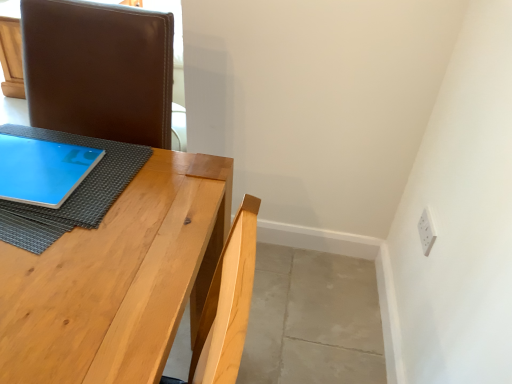
Locate an element on the screen. This screenshot has height=384, width=512. blue fabric at upper left is located at coordinates (73, 192).

Identify the location of blue fabric at upper left. (73, 192).

From the image's perspective, is blue fabric at upper left on natural wood table at center?

Indeed, from the image's perspective, blue fabric at upper left is shown above natural wood table at center.

Considering the relative sizes of blue fabric at upper left and natural wood table at center in the image provided, is blue fabric at upper left taller than natural wood table at center?

Incorrect, the height of blue fabric at upper left is not larger of that of natural wood table at center.

Is blue fabric at upper left far from natural wood table at center?

No, blue fabric at upper left is not far away from natural wood table at center.

The height and width of the screenshot is (384, 512). I want to click on table that is below the blue fabric at upper left (from the image's perspective), so click(116, 277).

From the image's perspective, is blue fabric at upper left positioned above or below white plastic electric outlet at upper right?

From the image's perspective, blue fabric at upper left appears above white plastic electric outlet at upper right.

Can you confirm if blue fabric at upper left is thinner than white plastic electric outlet at upper right?

No.

Is blue fabric at upper left outside of white plastic electric outlet at upper right?

Yes, blue fabric at upper left is located beyond the bounds of white plastic electric outlet at upper right.

Between blue fabric at upper left and white plastic electric outlet at upper right, which one has smaller size?

With smaller size is white plastic electric outlet at upper right.

Is matte blue tablet at left further to camera compared to white plastic electric outlet at upper right?

No, matte blue tablet at left is closer to the viewer.

Image resolution: width=512 pixels, height=384 pixels. Identify the location of electric outlet below the matte blue tablet at left (from a real-world perspective). (426, 231).

Could you tell me if matte blue tablet at left is facing white plastic electric outlet at upper right?

No.

Which object is positioned more to the right, matte blue tablet at left or white plastic electric outlet at upper right?

white plastic electric outlet at upper right.

Considering the relative sizes of matte blue tablet at left and natural wood table at center in the image provided, is matte blue tablet at left shorter than natural wood table at center?

Yes, matte blue tablet at left is shorter than natural wood table at center.

Does matte blue tablet at left have a lesser width compared to natural wood table at center?

Indeed, matte blue tablet at left has a lesser width compared to natural wood table at center.

How different are the orientations of natural wood table at center and blue fabric at upper left in degrees?

The angle between the facing direction of natural wood table at center and the facing direction of blue fabric at upper left is 3.26 degrees.

Can you confirm if natural wood table at center is thinner than blue fabric at upper left?

Yes.

Where is `table directly beneath the blue fabric at upper left (from a real-world perspective)`? Image resolution: width=512 pixels, height=384 pixels. table directly beneath the blue fabric at upper left (from a real-world perspective) is located at coordinates 116,277.

Does natural wood table at center lie behind blue fabric at upper left?

No, natural wood table at center is closer to the camera.

Is natural wood table at center next to white plastic electric outlet at upper right and touching it?

There is a gap between natural wood table at center and white plastic electric outlet at upper right.

Considering the relative sizes of natural wood table at center and white plastic electric outlet at upper right in the image provided, is natural wood table at center taller than white plastic electric outlet at upper right?

Yes, natural wood table at center is taller than white plastic electric outlet at upper right.

From a real-world perspective, is natural wood table at center above or below white plastic electric outlet at upper right?

From a real-world perspective, natural wood table at center is physically above white plastic electric outlet at upper right.

From the image's perspective, is natural wood table at center over white plastic electric outlet at upper right?

No, from the image's perspective, natural wood table at center is not over white plastic electric outlet at upper right.

Is matte blue tablet at left oriented away from blue fabric at upper left?

No, matte blue tablet at left's orientation is not away from blue fabric at upper left.

Can you confirm if matte blue tablet at left is taller than blue fabric at upper left?

Yes.

Which is more to the left, matte blue tablet at left or blue fabric at upper left?

Positioned to the left is matte blue tablet at left.

Identify the location of table below the blue fabric at upper left (from a real-world perspective). (116, 277).

Where is `electric outlet that is below the blue fabric at upper left (from the image's perspective)`? electric outlet that is below the blue fabric at upper left (from the image's perspective) is located at coordinates (426, 231).

From the image, which object appears to be nearer to matte blue tablet at left, white plastic electric outlet at upper right or blue fabric at upper left?

The object closer to matte blue tablet at left is blue fabric at upper left.

Which object lies further to the anchor point white plastic electric outlet at upper right, natural wood table at center or matte blue tablet at left?

The object further to white plastic electric outlet at upper right is matte blue tablet at left.

Considering their positions, is blue fabric at upper left positioned further to natural wood table at center than matte blue tablet at left?

Based on the image, matte blue tablet at left appears to be further to natural wood table at center.

From the image, which object appears to be nearer to blue fabric at upper left, natural wood table at center or matte blue tablet at left?

Based on the image, matte blue tablet at left appears to be nearer to blue fabric at upper left.

Which object lies further to the anchor point blue fabric at upper left, matte blue tablet at left or white plastic electric outlet at upper right?

white plastic electric outlet at upper right is further to blue fabric at upper left.

From the image, which object appears to be farther from white plastic electric outlet at upper right, natural wood table at center or blue fabric at upper left?

blue fabric at upper left lies further to white plastic electric outlet at upper right than the other object.

Looking at the image, which one is located closer to white plastic electric outlet at upper right, blue fabric at upper left or matte blue tablet at left?

Based on the image, blue fabric at upper left appears to be nearer to white plastic electric outlet at upper right.

Which object lies nearer to the anchor point white plastic electric outlet at upper right, blue fabric at upper left or natural wood table at center?

natural wood table at center is positioned closer to the anchor white plastic electric outlet at upper right.

Where is `table between blue fabric at upper left and white plastic electric outlet at upper right in the horizontal direction`? table between blue fabric at upper left and white plastic electric outlet at upper right in the horizontal direction is located at coordinates (116, 277).

The width and height of the screenshot is (512, 384). In order to click on cloth located between matte blue tablet at left and white plastic electric outlet at upper right in the left-right direction in this screenshot , I will do `click(73, 192)`.

Image resolution: width=512 pixels, height=384 pixels. What are the coordinates of `table located between matte blue tablet at left and white plastic electric outlet at upper right in the left-right direction` in the screenshot? It's located at (116, 277).

The image size is (512, 384). I want to click on cloth between natural wood table at center and matte blue tablet at left in the front-back direction, so click(x=73, y=192).